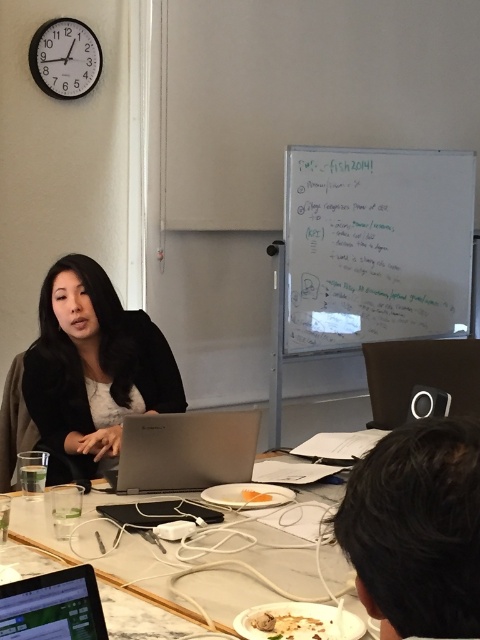
Question: Does whiteboard at upper center appear over golden brown bread at lower center?

Choices:
 (A) no
 (B) yes

Answer: (B)

Question: Which point is farther to the camera?

Choices:
 (A) (244, 496)
 (B) (58, 403)

Answer: (B)

Question: In this image, where is silver metallic laptop at center located relative to silver metallic laptop at lower left?

Choices:
 (A) below
 (B) above

Answer: (A)

Question: Based on their relative distances, which object is nearer to the orange matte plate at center?

Choices:
 (A) matte black jacket at center
 (B) whiteboard at upper center
 (C) silver metallic laptop at center
 (D) dark brown hair at lower right

Answer: (C)

Question: Which of the following is the closest to the observer?

Choices:
 (A) golden brown bread at lower center
 (B) dark brown hair at lower right
 (C) matte black jacket at center
 (D) white marble table at lower center

Answer: (B)

Question: Is silver metallic laptop at center to the right of golden brown bread at lower center from the viewer's perspective?

Choices:
 (A) yes
 (B) no

Answer: (B)